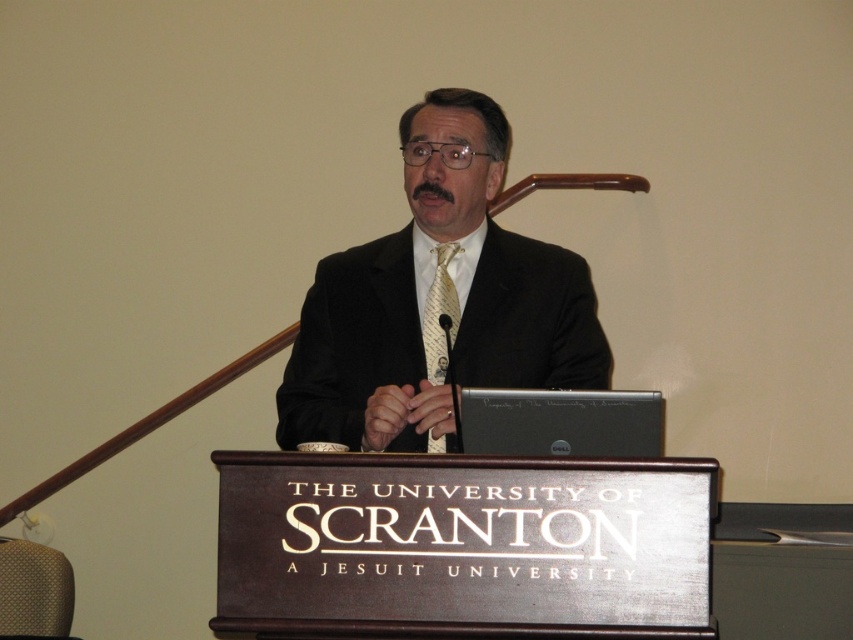
You are a photographer at the event and need to capture a closeup of the speaker. The camera you are using has a depth of field that can focus on objects within a 5.5 inch range. If you focus on the black silk suit at center, will the yellow silk tie at center also be in focus?

The black silk suit at center is 6.05 inches away from the yellow silk tie at center. Since the distance between them exceeds the camera sensor depth of field range of 5.5 inches, focusing on the black silk suit at center would likely leave the yellow silk tie at center slightly out of focus.

You are standing at the point labeled as point (552, 330) in the image. The man behind the podium is facing you. If you want to approach him without being noticed, should you walk directly towards him or move sideways?

You should move sideways instead of walking directly towards him because the distance between you and the man is 3.23 meters, and moving sideways might allow you to approach without entering his direct line of sight.

Based on the photo, you are organizing a presentation and need to place a name tag on the podium. The name tag is 15 cm wide. The black matte laptop at center and the yellow silk tie at center are already on the podium. Can you fit the name tag between them without overlapping?

The black matte laptop at center is smaller than the yellow silk tie at center. Since the laptop is smaller, there might be enough space between them to fit the 15 cm name tag, but it depends on their exact positions. However, based on the given information, we cannot determine the distance between them. Please check the actual spacing.